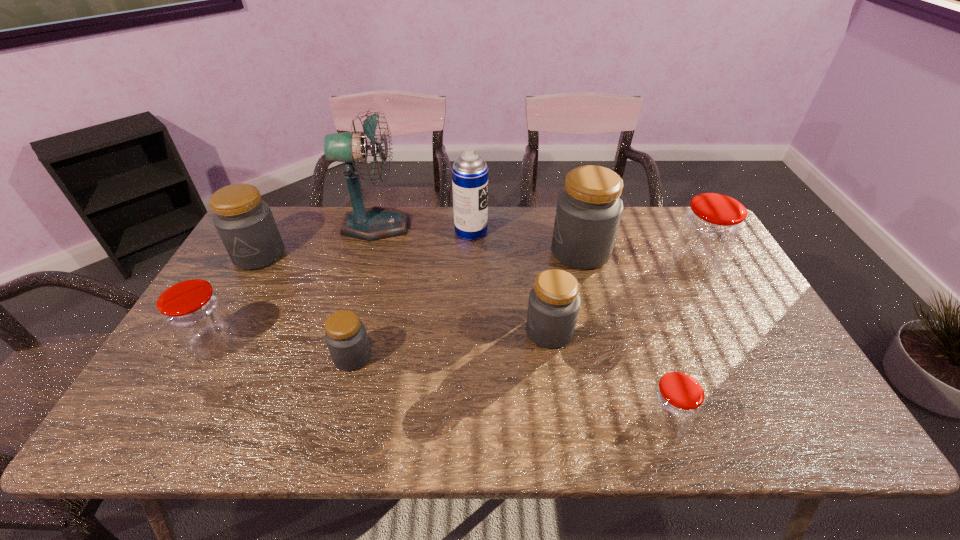
This screenshot has width=960, height=540. What are the coordinates of `the tallest object` in the screenshot? It's located at (374, 223).

Identify the location of fan. The width and height of the screenshot is (960, 540). (374, 223).

Identify the location of blue aerosol can. (469, 172).

Identify the location of the fifth object from right to left. Image resolution: width=960 pixels, height=540 pixels. (469, 172).

Image resolution: width=960 pixels, height=540 pixels. Identify the location of the tallest jar. (589, 209).

Where is `the second biggest gray jar`? the second biggest gray jar is located at coordinates (245, 223).

What are the coordinates of `the biggest red jar` in the screenshot? It's located at (708, 232).

Find the location of a particular element. Image resolution: width=960 pixels, height=540 pixels. the rightmost jar is located at coordinates (708, 232).

You are a GUI agent. You are given a task and a screenshot of the screen. Output one action in this format:
    pyautogui.click(x=<x>, y=<y>)
    Task: Click on the second smallest gray jar
    
    Given the screenshot: What is the action you would take?
    pyautogui.click(x=554, y=302)

This screenshot has width=960, height=540. I want to click on the second biggest red jar, so click(x=195, y=314).